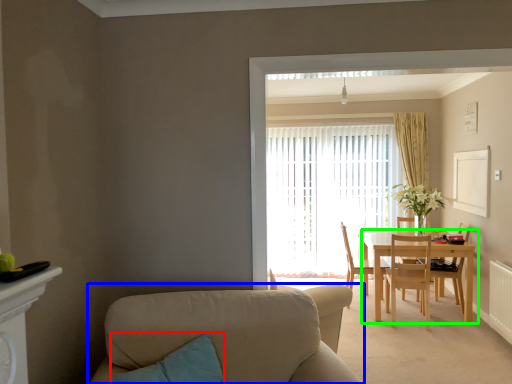
Question: Based on their relative distances, which object is nearer to pillow (highlighted by a red box)? Choose from studio couch (highlighted by a blue box) and kitchen & dining room table (highlighted by a green box).

Choices:
 (A) studio couch
 (B) kitchen & dining room table

Answer: (A)